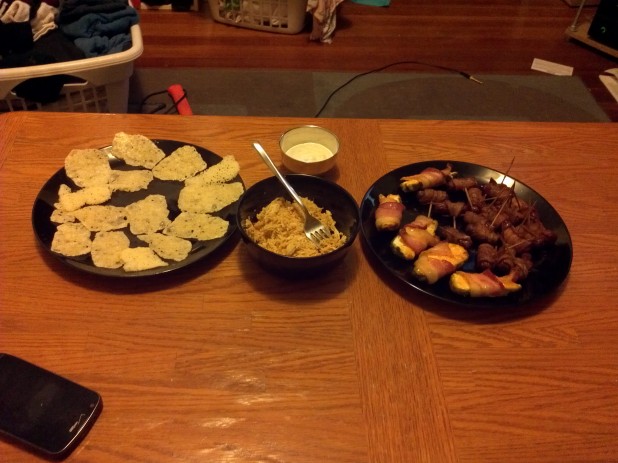
At what (x,y) coordinates should I click in order to perform the action: click on cables on the floor. Please return your answer as a coordinate pair (x, y). Looking at the image, I should click on click(462, 76), click(159, 112).